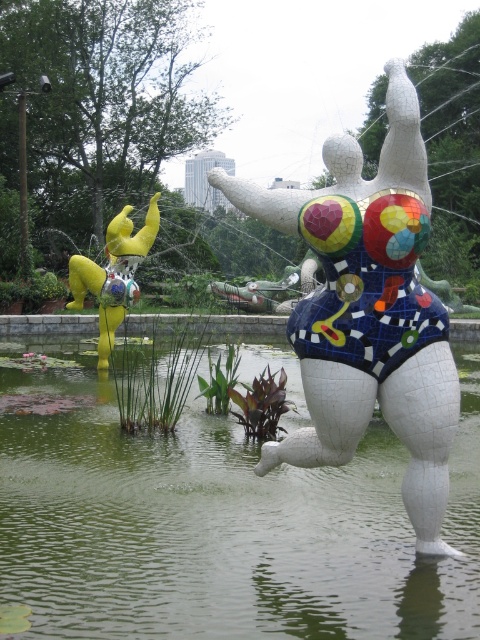
From the picture: You are an art student standing in front of the pond. You want to take a photo of both the cracked mosaic torso at center and the metallic yellow sculpture at left. Which sculpture should you focus on first to ensure both are in the frame?

You should focus on the cracked mosaic torso at center first because it is in front of the metallic yellow sculpture at left, so adjusting the camera to include the closer one will naturally include the background sculpture as well.

You are an artist planning to paint the scene. You need to know the relative positions of the green liquid water at center and the metallic yellow sculpture at left. Which one is located to the right of the other?

The green liquid water at center is positioned on the right side of metallic yellow sculpture at left.

Based on the photo, you are standing at the edge of the pond and want to reach the white sculpture with raised arms. You notice a point marked at coordinates (215, 520). What is located at this point?

The point at coordinates (215, 520) corresponds to green liquid water at center.